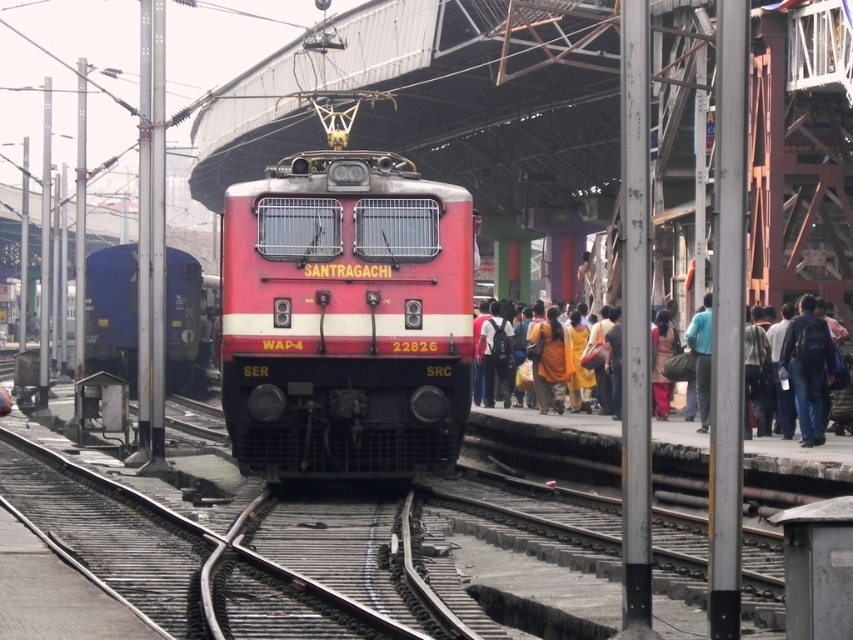
Is point (503, 412) positioned in front of point (790, 344)?

No, (503, 412) is further to viewer.

Is point (556, 422) behind point (820, 342)?

Yes, it is behind point (820, 342).

The height and width of the screenshot is (640, 853). In order to click on yellow cotton dress at right in this screenshot , I will do `click(556, 420)`.

Where is `matte red train at center`? The image size is (853, 640). matte red train at center is located at coordinates (345, 317).

Which is more to the left, matte red train at center or denim jeans at right?

Positioned to the left is matte red train at center.

I want to click on matte red train at center, so click(345, 317).

Is matte red train at center taller than yellow cotton dress at right?

Incorrect, matte red train at center's height is not larger of yellow cotton dress at right's.

Which is above, matte red train at center or yellow cotton dress at right?

yellow cotton dress at right is above.

The height and width of the screenshot is (640, 853). I want to click on matte red train at center, so click(x=345, y=317).